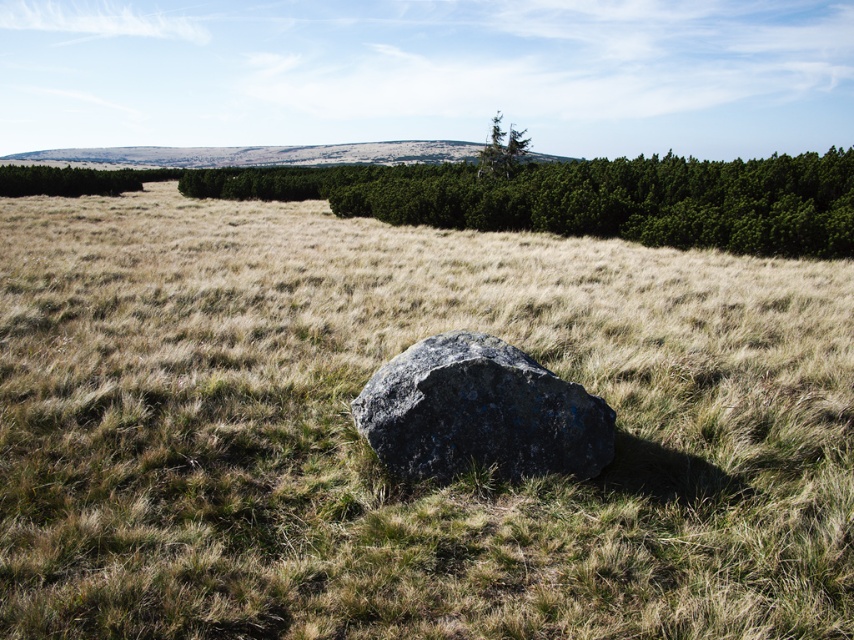
You are a hiker trying to navigate through the brown grassy at center and gray rough boulder at center. Which one covers more ground area?

The brown grassy at center is larger in size than the gray rough boulder at center, so it covers more ground area.

You are standing at the edge of the grassy field and see the gray rough boulder at center. If you walk straight towards the boulder, how far will you have to walk to reach it?

You will have to walk 4.29 meters to reach the gray rough boulder at center.

You are standing at the point marked as point (375, 456) in the image. Looking around, you see brown grassy at center. What is the immediate terrain under your feet?

The immediate terrain under your feet is the brown grassy at center, as the point (375, 456) is located on it.